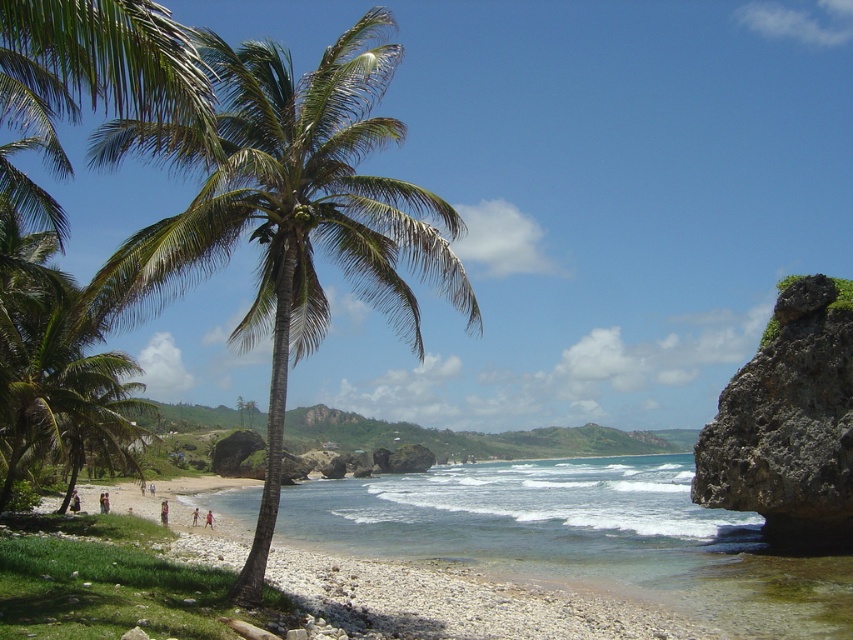
Based on the photo, does rocky cliff at right have a lesser height compared to blurred human figure at center?

In fact, rocky cliff at right may be taller than blurred human figure at center.

Who is taller, rocky cliff at right or blurred human figure at center?

With more height is rocky cliff at right.

Does point (708, 433) lie behind point (105, 508)?

No, (708, 433) is in front of (105, 508).

Identify the location of rocky cliff at right. (788, 426).

Is pink fabric dress at lower center to the left of blurred human figure at center from the viewer's perspective?

Incorrect, pink fabric dress at lower center is not on the left side of blurred human figure at center.

In order to click on pink fabric dress at lower center in this screenshot , I will do `click(163, 513)`.

The height and width of the screenshot is (640, 853). In order to click on pink fabric dress at lower center in this screenshot , I will do `click(163, 513)`.

Is point (196, 232) farther from viewer compared to point (180, 540)?

No, (196, 232) is closer to viewer.

Can you confirm if green leafy palm tree at left is positioned to the left of white gravel beach at center?

No, green leafy palm tree at left is not to the left of white gravel beach at center.

What do you see at coordinates (286, 212) in the screenshot? I see `green leafy palm tree at left` at bounding box center [286, 212].

Where is `green leafy palm tree at left`? Image resolution: width=853 pixels, height=640 pixels. green leafy palm tree at left is located at coordinates (286, 212).